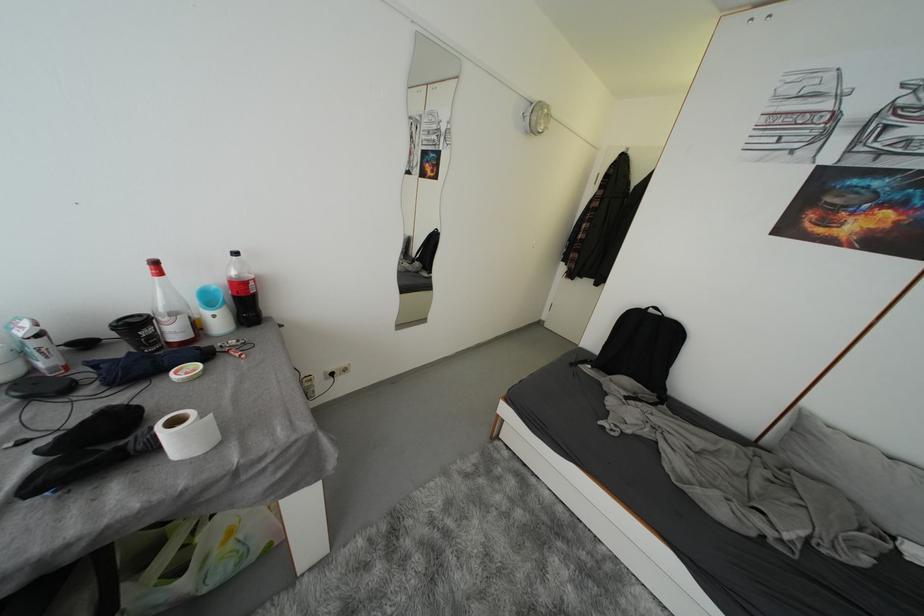
Identify the location of white cabinet handle. Image resolution: width=924 pixels, height=616 pixels. (715, 575).